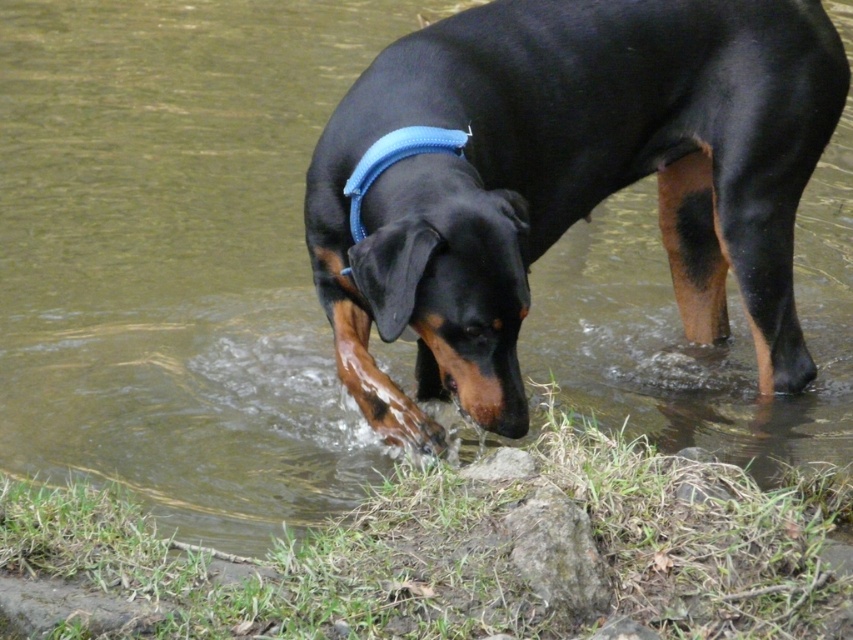
Question: Does black shiny dog at center have a larger size compared to blue fabric neckband at center?

Choices:
 (A) no
 (B) yes

Answer: (B)

Question: Among these points, which one is nearest to the camera?

Choices:
 (A) (781, 355)
 (B) (372, 157)

Answer: (B)

Question: Can you confirm if black shiny dog at center is bigger than blue fabric neckband at center?

Choices:
 (A) yes
 (B) no

Answer: (A)

Question: Which point appears closest to the camera in this image?

Choices:
 (A) (393, 131)
 (B) (459, 100)

Answer: (A)

Question: Which object appears closest to the camera in this image?

Choices:
 (A) blue fabric neckband at center
 (B) black shiny dog at center

Answer: (B)

Question: Is black shiny dog at center smaller than blue fabric neckband at center?

Choices:
 (A) no
 (B) yes

Answer: (A)